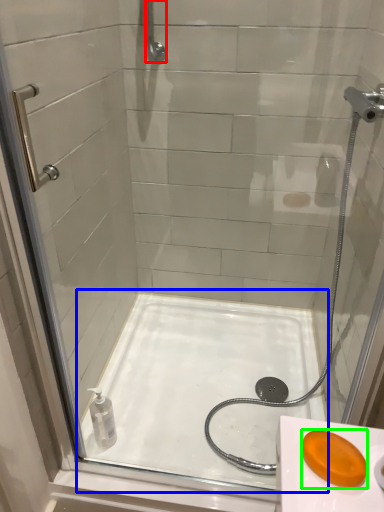
Question: Which is farther away from shower (highlighted by a red box)? bath (highlighted by a blue box) or soap (highlighted by a green box)?

Choices:
 (A) bath
 (B) soap

Answer: (B)